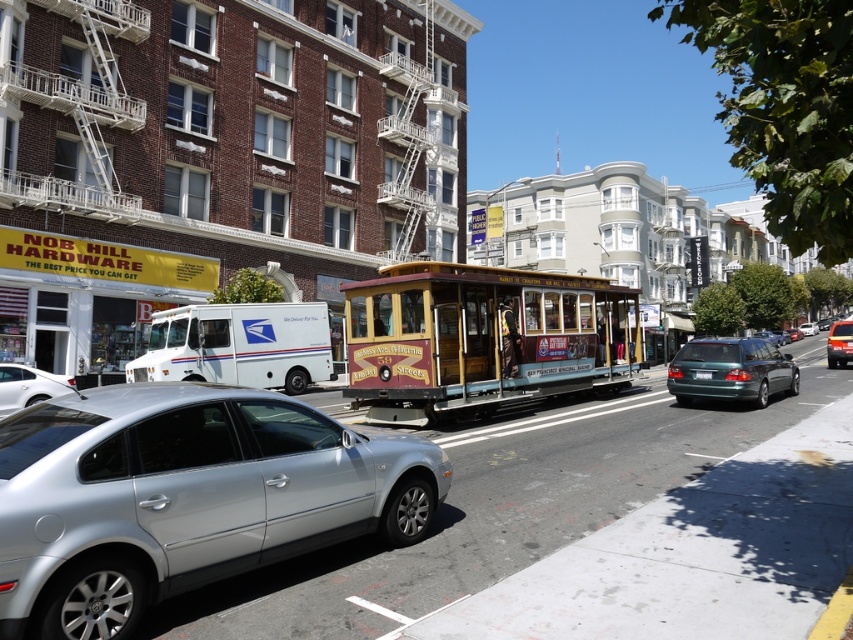
Locate an element on the screen. Image resolution: width=853 pixels, height=640 pixels. green matte sedan at lower right is located at coordinates (730, 371).

Between green matte sedan at lower right and silver metallic sedan at lower left, which one has more height?

With more height is green matte sedan at lower right.

Between point (795, 390) and point (50, 376), which one is positioned behind?

The point (795, 390) is behind.

Where is `green matte sedan at lower right`? This screenshot has width=853, height=640. green matte sedan at lower right is located at coordinates coord(730,371).

Between silver metallic car at lower left and silver metallic sedan at lower left, which one is positioned lower?

silver metallic sedan at lower left is below.

Is silver metallic car at lower left bigger than silver metallic sedan at lower left?

Yes, silver metallic car at lower left is bigger than silver metallic sedan at lower left.

Image resolution: width=853 pixels, height=640 pixels. Identify the location of silver metallic car at lower left. (184, 497).

Can you confirm if wooden polished cable car at center is positioned to the left of green matte sedan at lower right?

Yes, wooden polished cable car at center is to the left of green matte sedan at lower right.

Looking at this image, is wooden polished cable car at center closer to camera compared to green matte sedan at lower right?

That is True.

Is point (534, 390) closer to camera compared to point (708, 378)?

No, it is not.

Identify the location of wooden polished cable car at center. (482, 339).